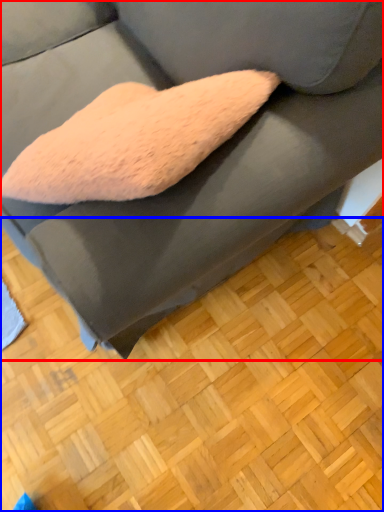
Question: Which of the following is the closest to the observer, studio couch (highlighted by a red box) or hardwood (highlighted by a blue box)?

Choices:
 (A) studio couch
 (B) hardwood

Answer: (A)